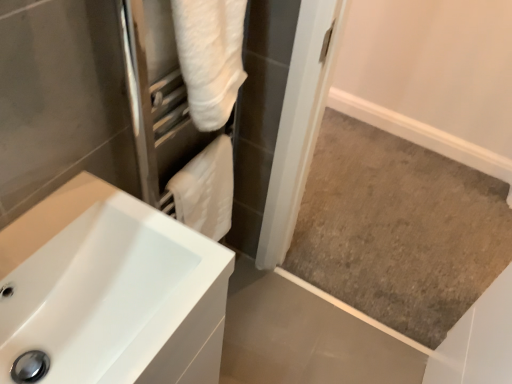
Question: From the image's perspective, relative to white fluffy towel at upper center, is white glossy sink at lower left above or below?

Choices:
 (A) above
 (B) below

Answer: (B)

Question: From a real-world perspective, relative to white fluffy towel at upper center, is white glossy sink at lower left vertically above or below?

Choices:
 (A) above
 (B) below

Answer: (B)

Question: Which is nearer to the white glossy sink at lower left?

Choices:
 (A) white fluffy towel at upper center
 (B) white soft towel at center

Answer: (B)

Question: Estimate the real-world distances between objects in this image. Which object is closer to the white soft towel at center?

Choices:
 (A) white fluffy towel at upper center
 (B) white glossy sink at lower left

Answer: (A)